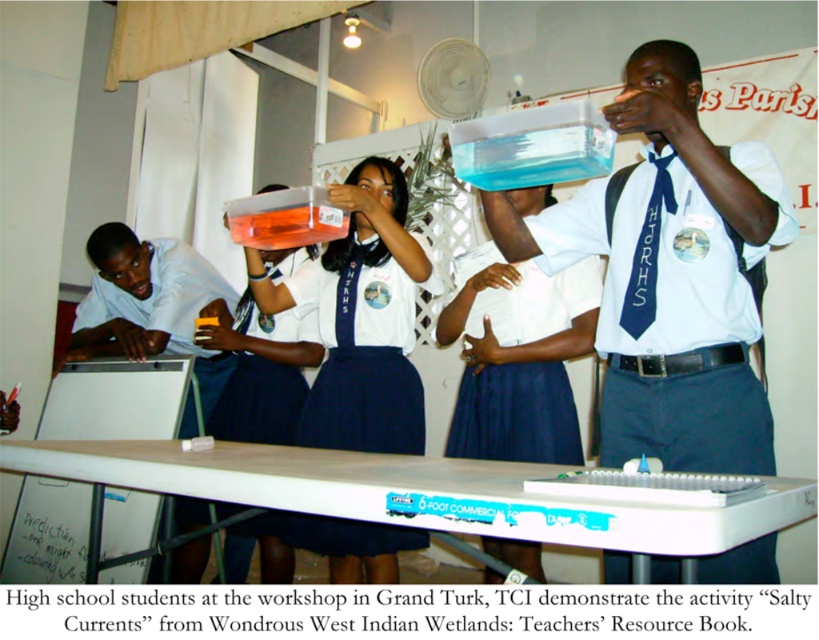
Is white fabric shirt at upper center below white fabric shirt at center?

No, white fabric shirt at upper center is not below white fabric shirt at center.

Between white fabric shirt at upper center and white fabric shirt at center, which one has less height?

With less height is white fabric shirt at center.

Which is in front, point (749, 577) or point (338, 300)?

Point (749, 577) is more forward.

Where is `white fabric shirt at upper center`? The image size is (819, 640). white fabric shirt at upper center is located at coordinates (667, 321).